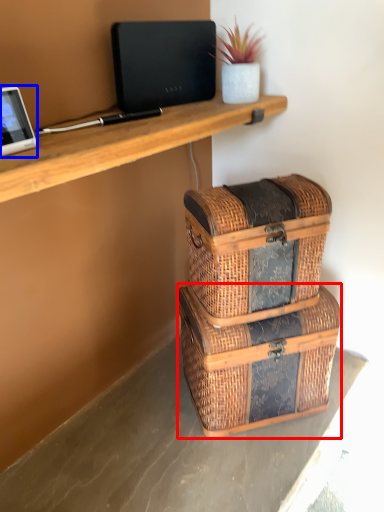
Question: Which object appears closest to the camera in this image, storage box (highlighted by a red box) or tablet computer (highlighted by a blue box)?

Choices:
 (A) storage box
 (B) tablet computer

Answer: (B)